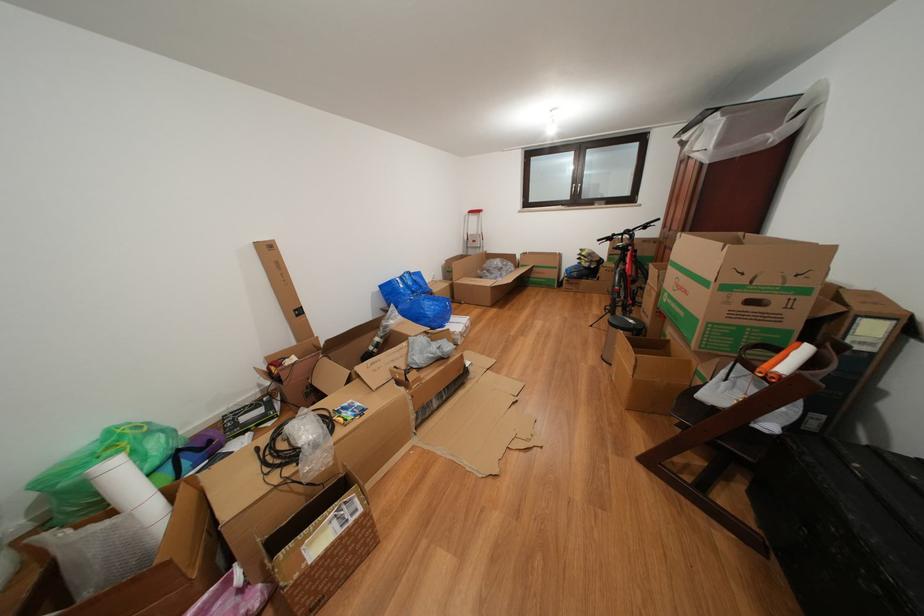
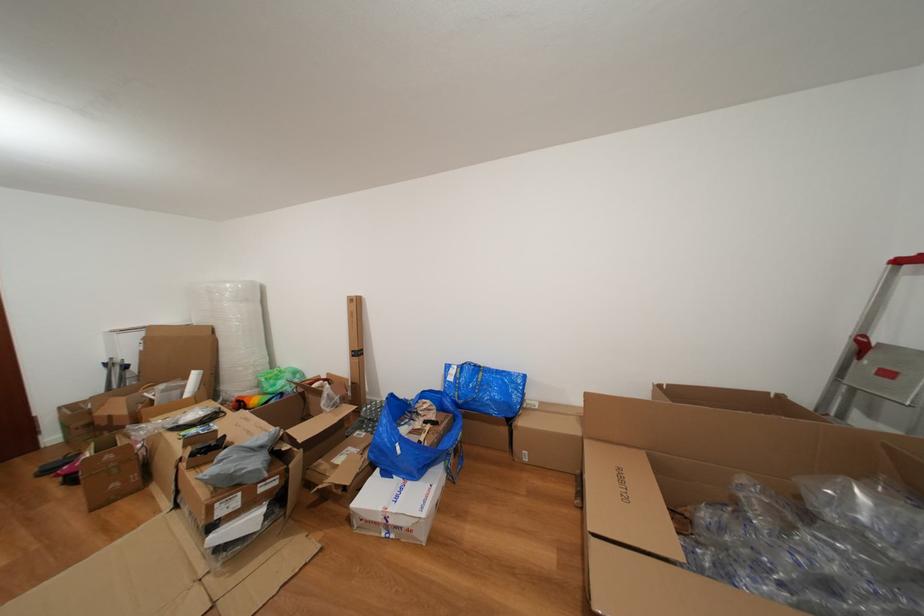
Find the pixel in the second image that matches pixel 409 291 in the first image.

(458, 384)